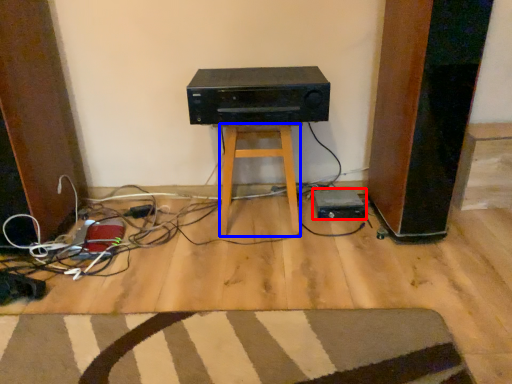
Question: Which point is further to the camera, appliance (highlighted by a red box) or stool (highlighted by a blue box)?

Choices:
 (A) appliance
 (B) stool

Answer: (A)